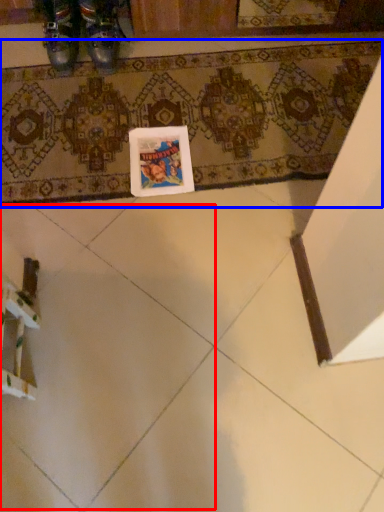
Question: Which object appears closest to the camera in this image, ceramic tile (highlighted by a red box) or bath mat (highlighted by a blue box)?

Choices:
 (A) ceramic tile
 (B) bath mat

Answer: (A)